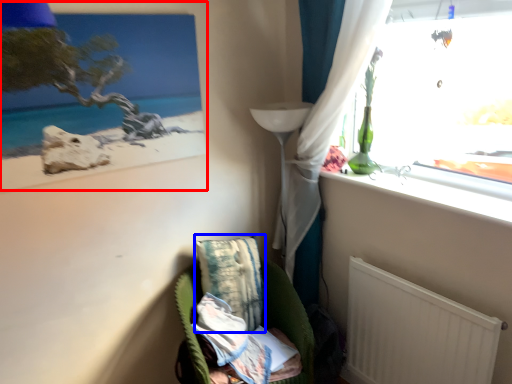
Question: Which object is further to the camera taking this photo, picture frame (highlighted by a red box) or pillow (highlighted by a blue box)?

Choices:
 (A) picture frame
 (B) pillow

Answer: (B)